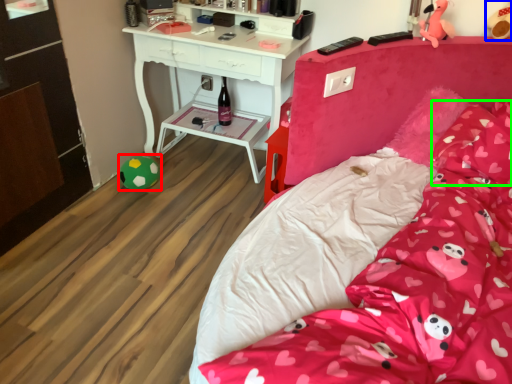
Question: Which object is the closest to the toy (highlighted by a red box)? Choose among these: toy (highlighted by a blue box) or pillow (highlighted by a green box).

Choices:
 (A) toy
 (B) pillow

Answer: (B)